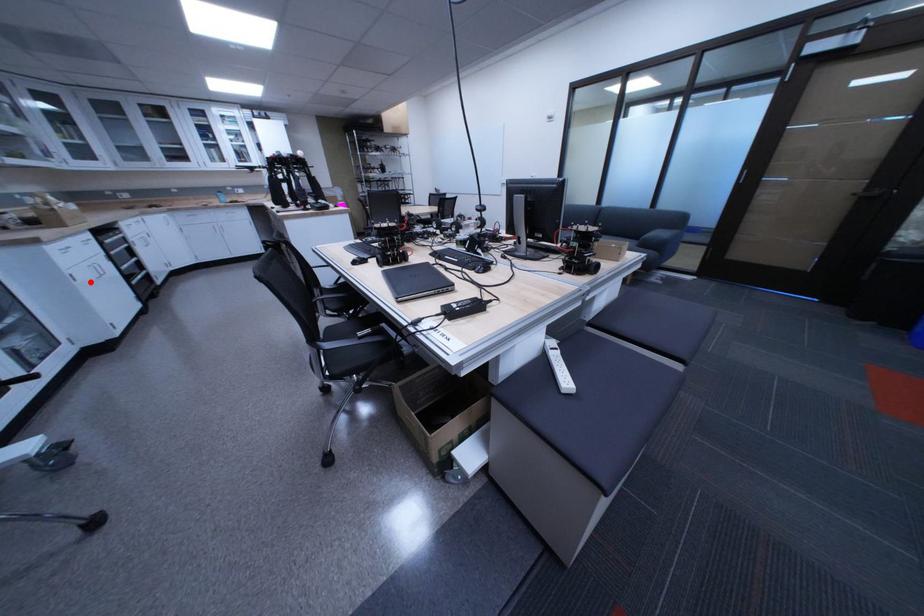
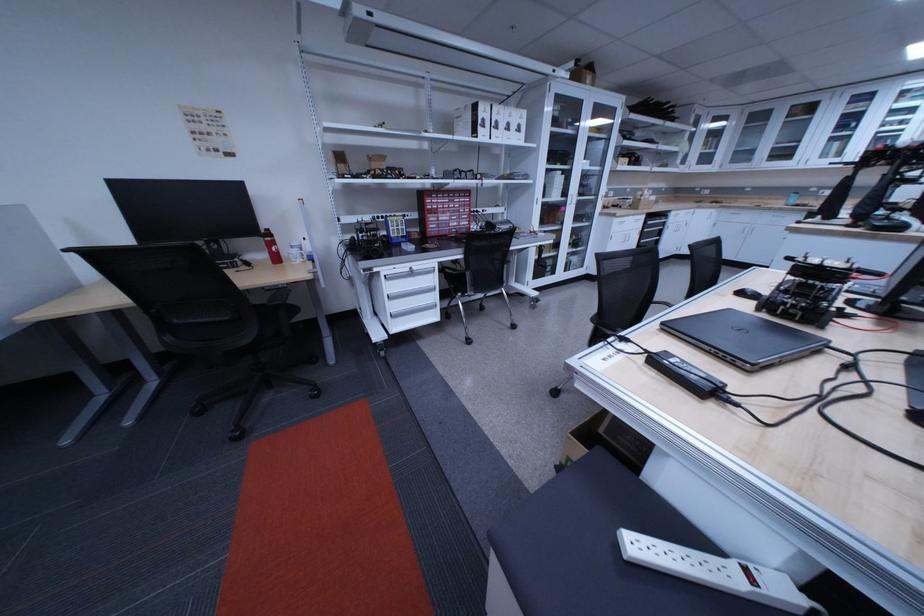
Question: I am providing you with two images of the same scene from different viewpoints. Given a red point in image1, look at the same physical point in image2. Is it:

Choices:
 (A) Closer to the viewpoint
 (B) Farther from the viewpoint

Answer: (A)